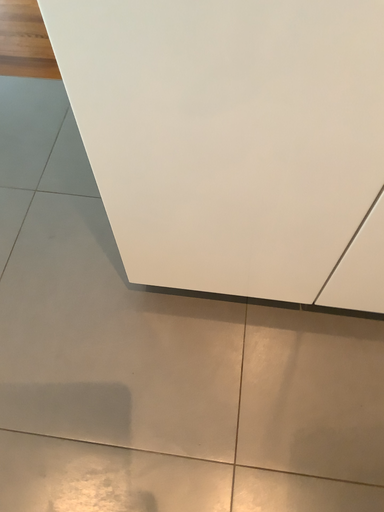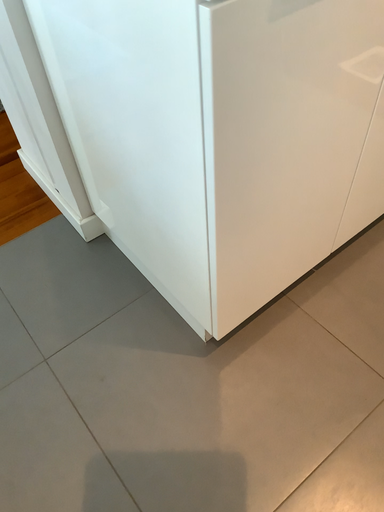
Question: Which way did the camera rotate in the video?

Choices:
 (A) rotated upward
 (B) rotated downward

Answer: (A)